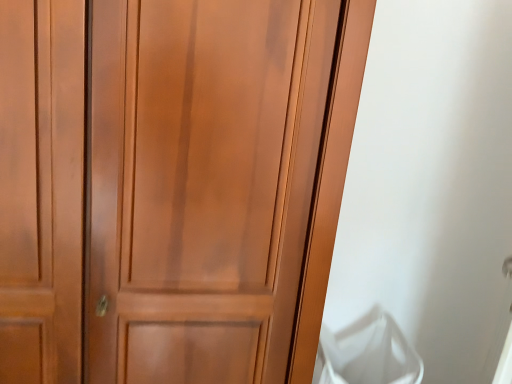
What do you see at coordinates (172, 185) in the screenshot? The height and width of the screenshot is (384, 512). I see `matte wood door at center` at bounding box center [172, 185].

You are a GUI agent. You are given a task and a screenshot of the screen. Output one action in this format:
    pyautogui.click(x=<x>, y=<y>)
    Task: Click on the matte wood door at center
    Image resolution: width=512 pixels, height=384 pixels.
    Given the screenshot: What is the action you would take?
    pyautogui.click(x=172, y=185)

Locate an element on the screen. matte wood door at center is located at coordinates (172, 185).